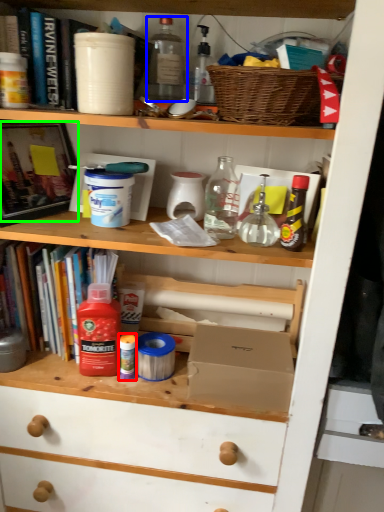
Question: Which object is positioned closest to bottle (highlighted by a red box)? Select from bottle (highlighted by a blue box) and book (highlighted by a green box).

Choices:
 (A) bottle
 (B) book

Answer: (B)